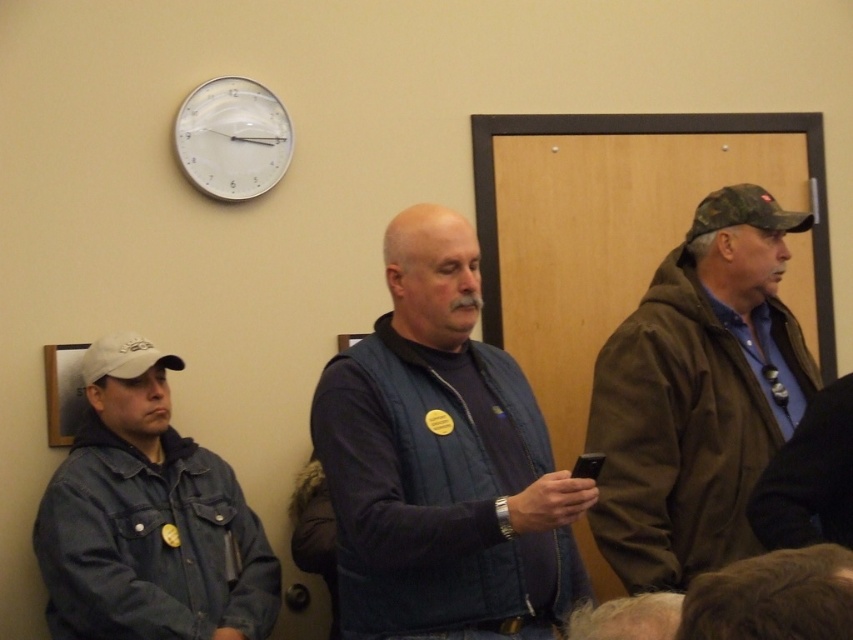
Does blue denim vest at center have a lesser width compared to black plastic phone at center?

No, blue denim vest at center is not thinner than black plastic phone at center.

The width and height of the screenshot is (853, 640). Describe the element at coordinates (442, 461) in the screenshot. I see `blue denim vest at center` at that location.

The image size is (853, 640). I want to click on blue denim vest at center, so click(x=442, y=461).

Does blue denim vest at center have a lesser height compared to white plastic clock at upper center?

In fact, blue denim vest at center may be taller than white plastic clock at upper center.

In order to click on blue denim vest at center in this screenshot , I will do `click(442, 461)`.

Does denim jacket at left have a greater height compared to black plastic phone at center?

Correct, denim jacket at left is much taller as black plastic phone at center.

Can you confirm if denim jacket at left is positioned to the left of black plastic phone at center?

Indeed, denim jacket at left is positioned on the left side of black plastic phone at center.

Is point (189, 572) farther from camera compared to point (582, 461)?

Yes.

You are a GUI agent. You are given a task and a screenshot of the screen. Output one action in this format:
    pyautogui.click(x=<x>, y=<y>)
    Task: Click on the denim jacket at left
    This screenshot has height=640, width=853.
    Given the screenshot: What is the action you would take?
    pyautogui.click(x=148, y=518)